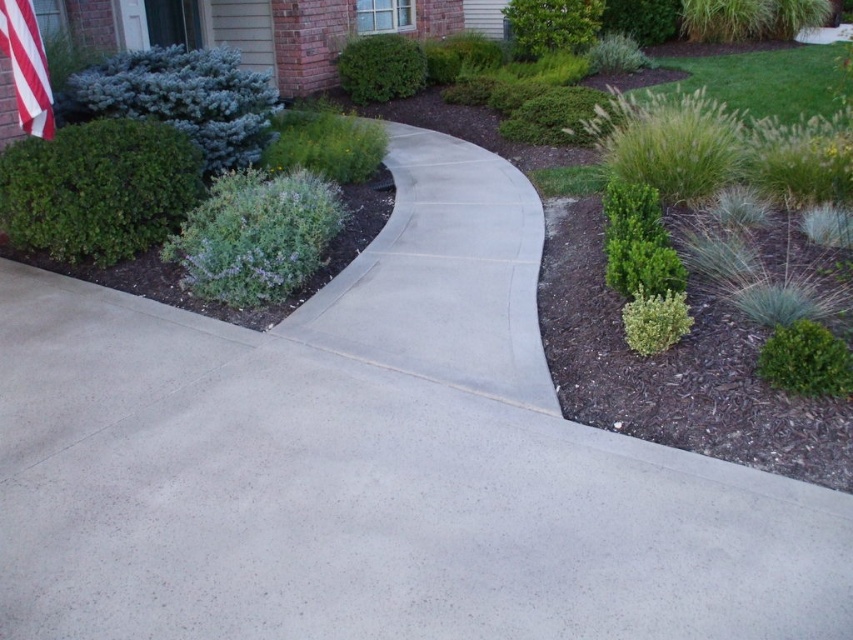
You are standing in the front yard and want to place a small garden ornament. You have two points marked in the image, point 1 at coordinates point (252,316) and point 2 at coordinates point (405,81). Which point is closer to you, point 1 or point 2?

Point 1 at coordinates point (252,316) is closer to you than point 2 at coordinates point (405,81).

You are a gardener planning to trim the green matte shrub at upper left and the green matte bush at upper center. Which of these two plants requires more time to trim due to its size?

The green matte shrub at upper left requires more time to trim because it is larger in size than the green matte bush at upper center.

You are a landscape designer planning to trim the bushes in the front yard. You notice the green matte bush at upper center and the red and white striped flag at upper left. Which object is taller?

The green matte bush at upper center is taller than the red and white striped flag at upper left according to the description.